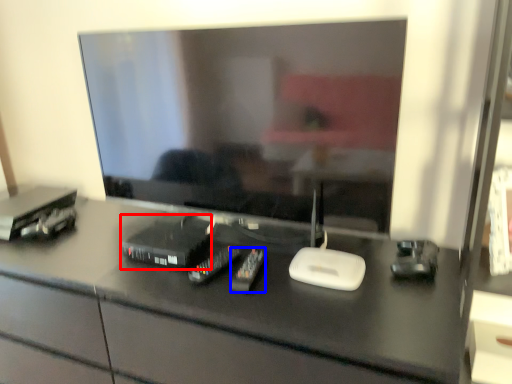
Question: Among these objects, which one is farthest to the camera, equipment (highlighted by a red box) or equipment (highlighted by a blue box)?

Choices:
 (A) equipment
 (B) equipment

Answer: (A)